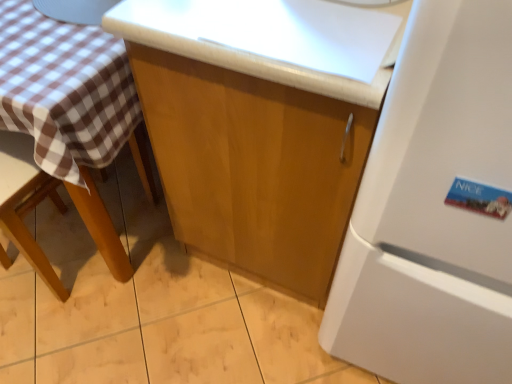
Question: Is white matte refrigerator at right outside glossy wood cabinet at center?

Choices:
 (A) no
 (B) yes

Answer: (B)

Question: Can you confirm if white matte refrigerator at right is taller than glossy wood cabinet at center?

Choices:
 (A) no
 (B) yes

Answer: (B)

Question: Can you confirm if white matte refrigerator at right is bigger than glossy wood cabinet at center?

Choices:
 (A) yes
 (B) no

Answer: (A)

Question: From a real-world perspective, does white matte refrigerator at right stand above glossy wood cabinet at center?

Choices:
 (A) yes
 (B) no

Answer: (A)

Question: Is white matte refrigerator at right beside glossy wood cabinet at center?

Choices:
 (A) no
 (B) yes

Answer: (A)

Question: Is the depth of white matte refrigerator at right greater than that of glossy wood cabinet at center?

Choices:
 (A) yes
 (B) no

Answer: (B)

Question: Can you confirm if brown wooden chair at left is positioned to the right of white matte refrigerator at right?

Choices:
 (A) no
 (B) yes

Answer: (A)

Question: Considering the relative positions of brown wooden chair at left and white matte refrigerator at right in the image provided, is brown wooden chair at left behind white matte refrigerator at right?

Choices:
 (A) yes
 (B) no

Answer: (A)

Question: Is brown wooden chair at left shorter than white matte refrigerator at right?

Choices:
 (A) yes
 (B) no

Answer: (A)

Question: From the image's perspective, does brown wooden chair at left appear lower than white matte refrigerator at right?

Choices:
 (A) no
 (B) yes

Answer: (B)

Question: Is brown wooden chair at left positioned far away from white matte refrigerator at right?

Choices:
 (A) yes
 (B) no

Answer: (B)

Question: From the image's perspective, is brown wooden chair at left above white matte refrigerator at right?

Choices:
 (A) yes
 (B) no

Answer: (B)

Question: From a real-world perspective, does glossy wood cabinet at center sit lower than white matte refrigerator at right?

Choices:
 (A) yes
 (B) no

Answer: (A)